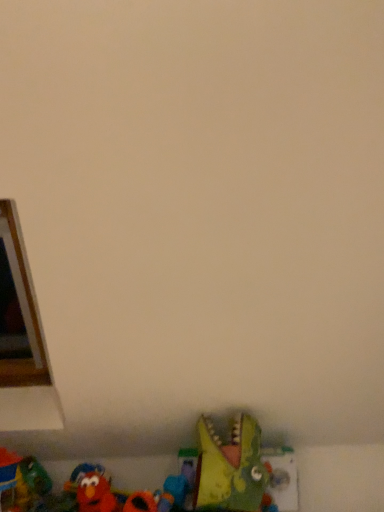
Question: Is rubber duck at lower center, which is the fourth toy in left-to-right order, at the left side of velvety red elmo at lower left, positioned as the 3th toy in right-to-left order?

Choices:
 (A) no
 (B) yes

Answer: (A)

Question: Does rubber duck at lower center, which is the fourth toy in left-to-right order, have a greater height compared to velvety red elmo at lower left, acting as the third toy starting from the left?

Choices:
 (A) yes
 (B) no

Answer: (B)

Question: Considering the relative sizes of rubber duck at lower center, which is the fourth toy in left-to-right order, and velvety red elmo at lower left, positioned as the 3th toy in right-to-left order, in the image provided, is rubber duck at lower center, which is the fourth toy in left-to-right order, shorter than velvety red elmo at lower left, positioned as the 3th toy in right-to-left order,?

Choices:
 (A) yes
 (B) no

Answer: (A)

Question: Is velvety red elmo at lower left, acting as the third toy starting from the left, at the back of rubber duck at lower center, which is the 2th toy in right-to-left order?

Choices:
 (A) no
 (B) yes

Answer: (A)

Question: From the image's perspective, is rubber duck at lower center, which is the fourth toy in left-to-right order, on velvety red elmo at lower left, positioned as the 3th toy in right-to-left order?

Choices:
 (A) yes
 (B) no

Answer: (A)

Question: Considering the positions of rubber duck at lower left, which ranks as the 5th toy in right-to-left order, and green plastic dinosaur at lower center, acting as the 5th toy starting from the left, in the image, is rubber duck at lower left, which ranks as the 5th toy in right-to-left order, wider or thinner than green plastic dinosaur at lower center, acting as the 5th toy starting from the left,?

Choices:
 (A) wide
 (B) thin

Answer: (A)

Question: Would you say rubber duck at lower left, which ranks as the 5th toy in right-to-left order, is to the left or to the right of green plastic dinosaur at lower center, the first toy positioned from the right, in the picture?

Choices:
 (A) left
 (B) right

Answer: (A)

Question: From a real-world perspective, is rubber duck at lower left, which appears as the 1th toy when viewed from the left, above or below green plastic dinosaur at lower center, the first toy positioned from the right?

Choices:
 (A) above
 (B) below

Answer: (B)

Question: From the image's perspective, is rubber duck at lower left, which ranks as the 5th toy in right-to-left order, positioned above or below green plastic dinosaur at lower center, acting as the 5th toy starting from the left?

Choices:
 (A) below
 (B) above

Answer: (A)

Question: From their relative heights in the image, would you say rubberized red toy at lower left, arranged as the fourth toy when viewed from the right, is taller or shorter than rubber duck at lower left, which appears as the 1th toy when viewed from the left?

Choices:
 (A) tall
 (B) short

Answer: (B)

Question: Relative to rubber duck at lower left, which appears as the 1th toy when viewed from the left, is rubberized red toy at lower left, which is the 2th toy from left to right, in front or behind?

Choices:
 (A) behind
 (B) front

Answer: (A)

Question: Looking at the image, does rubberized red toy at lower left, arranged as the fourth toy when viewed from the right, seem bigger or smaller compared to rubber duck at lower left, which ranks as the 5th toy in right-to-left order?

Choices:
 (A) big
 (B) small

Answer: (A)

Question: In terms of width, does rubberized red toy at lower left, arranged as the fourth toy when viewed from the right, look wider or thinner when compared to rubber duck at lower left, which appears as the 1th toy when viewed from the left?

Choices:
 (A) thin
 (B) wide

Answer: (B)

Question: Looking at their shapes, would you say rubber duck at lower left, which ranks as the 5th toy in right-to-left order, is wider or thinner than rubber duck at lower center, which is the fourth toy in left-to-right order?

Choices:
 (A) wide
 (B) thin

Answer: (A)

Question: Is rubber duck at lower left, which appears as the 1th toy when viewed from the left, bigger or smaller than rubber duck at lower center, which is the 2th toy in right-to-left order?

Choices:
 (A) big
 (B) small

Answer: (A)